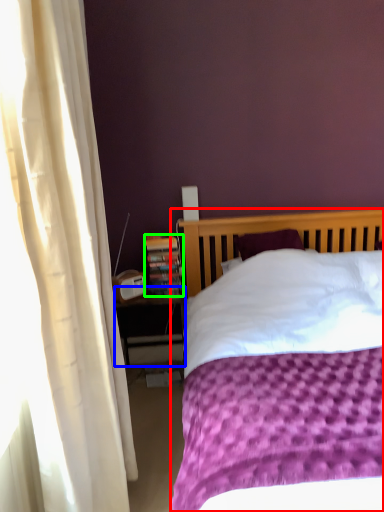
Question: Considering the real-world distances, which object is farthest from bed (highlighted by a red box)? nightstand (highlighted by a blue box) or paperback book (highlighted by a green box)?

Choices:
 (A) nightstand
 (B) paperback book

Answer: (A)